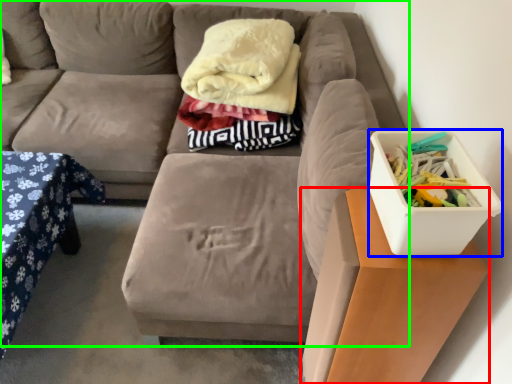
Question: Estimate the real-world distances between objects in this image. Which object is farther from table (highlighted by a red box), storage box (highlighted by a blue box) or studio couch (highlighted by a green box)?

Choices:
 (A) storage box
 (B) studio couch

Answer: (B)